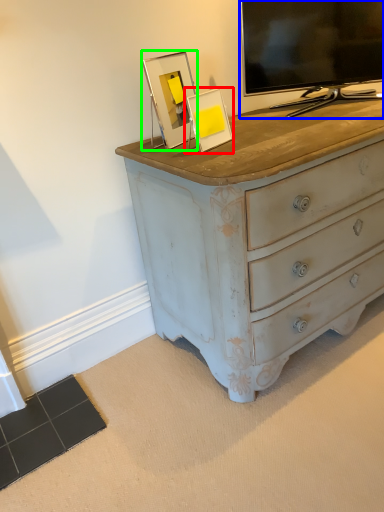
Question: Estimate the real-world distances between objects in this image. Which object is farther from picture frame (highlighted by a red box), television (highlighted by a blue box) or picture frame (highlighted by a green box)?

Choices:
 (A) television
 (B) picture frame

Answer: (A)